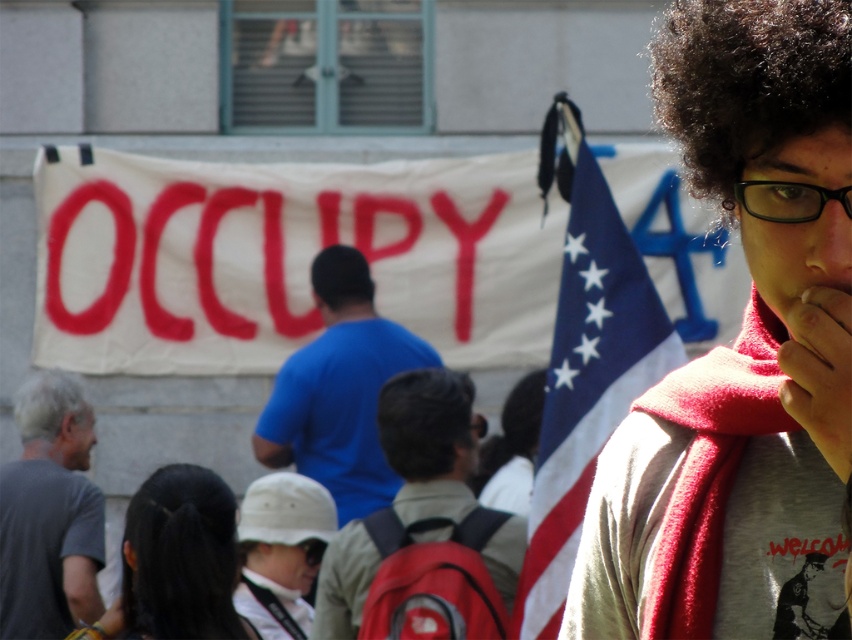
Question: Does american flag at right appear under black matte afro at center?

Choices:
 (A) yes
 (B) no

Answer: (A)

Question: Which object appears farthest from the camera in this image?

Choices:
 (A) american flag at right
 (B) red backpack at center
 (C) clear plastic glasses at upper right

Answer: (B)

Question: Which point is farther from the camera taking this photo?

Choices:
 (A) (410, 419)
 (B) (734, 164)
 (C) (50, 376)
 (D) (39, 419)

Answer: (C)

Question: Does black silky hair at lower center appear over gray matte afro at lower left?

Choices:
 (A) no
 (B) yes

Answer: (A)

Question: Among these objects, which one is farthest from the camera?

Choices:
 (A) black silky hair at lower center
 (B) red scarf at center
 (C) dark curly hair at upper right

Answer: (A)

Question: Is clear plastic glasses at upper right wider than black matte afro at center?

Choices:
 (A) yes
 (B) no

Answer: (B)